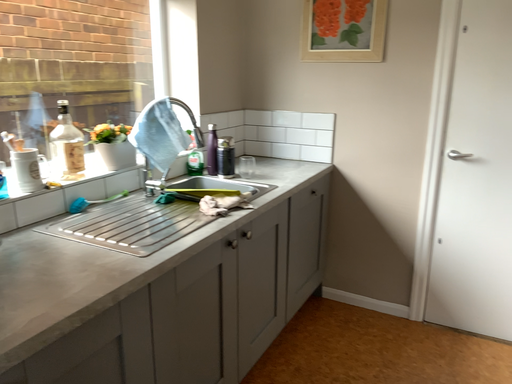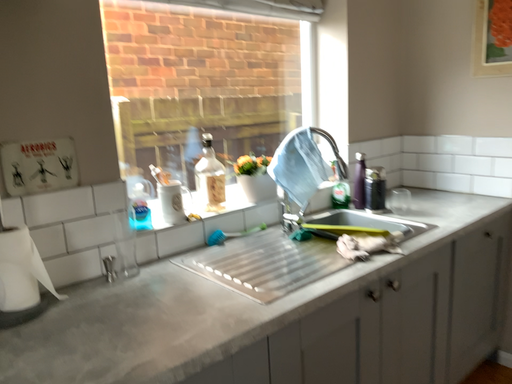
Question: How did the camera likely rotate when shooting the video?

Choices:
 (A) rotated left
 (B) rotated right

Answer: (A)